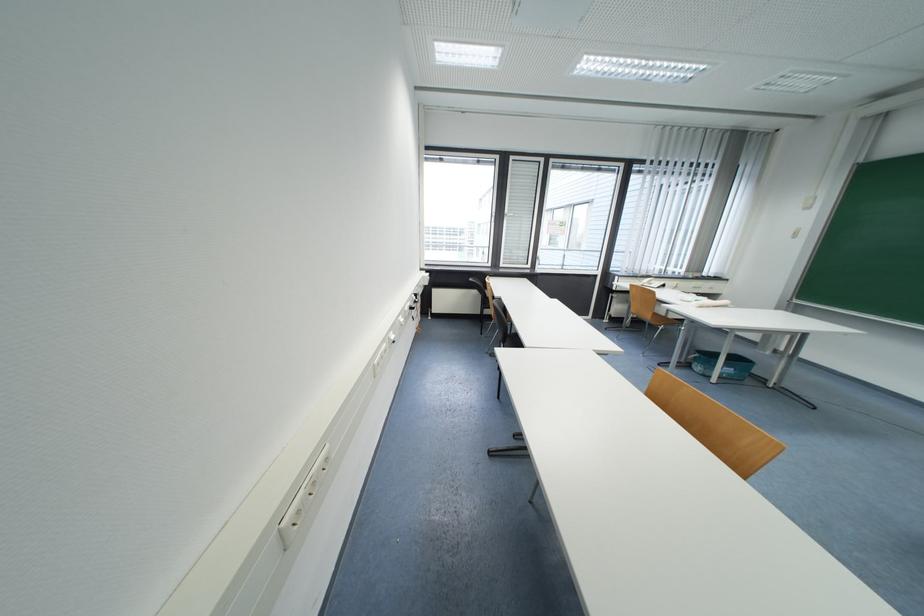
Find where to sit the brown chair sitting surface. Please return your answer as a coordinate pair (x, y).

(667, 312)